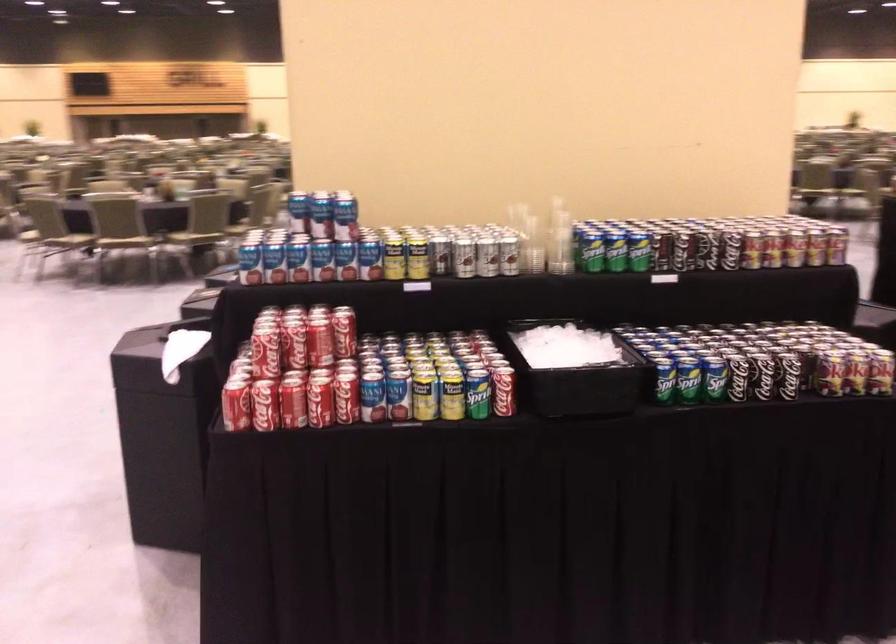
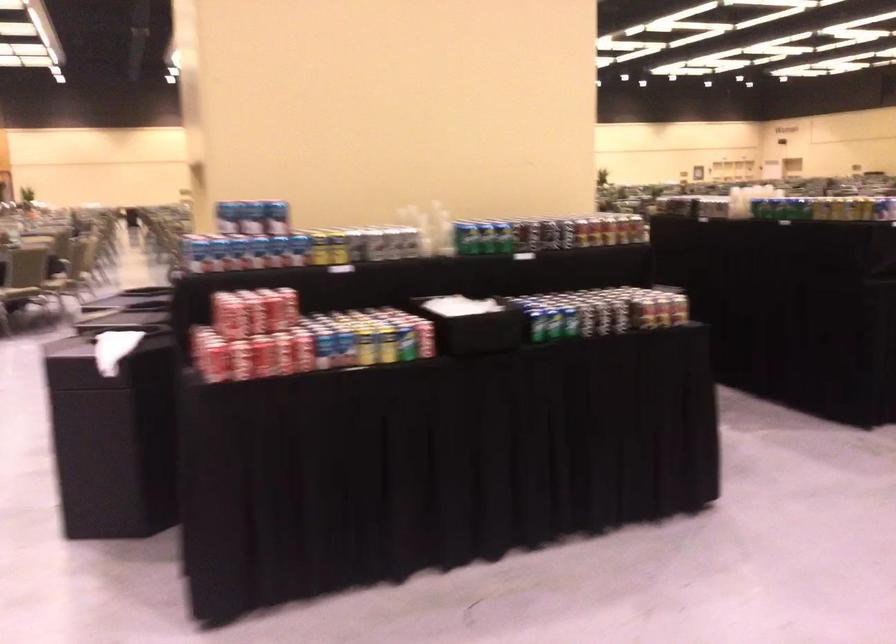
In the second image, find the point that corresponds to point (299, 213) in the first image.

(229, 216)